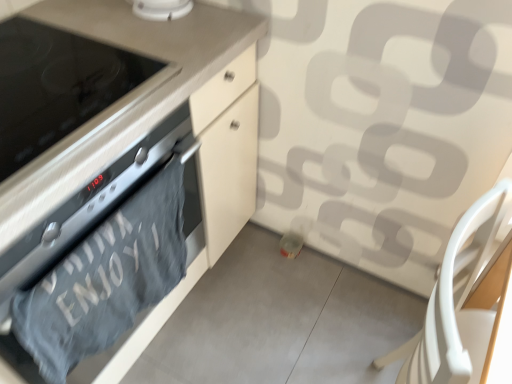
Question: Visually, is black glass stove at left positioned to the left or to the right of gray cotton towel at lower left?

Choices:
 (A) right
 (B) left

Answer: (B)

Question: Considering their positions, is black glass stove at left located in front of or behind gray cotton towel at lower left?

Choices:
 (A) front
 (B) behind

Answer: (A)

Question: Which object is the closest to the gray cotton towel at lower left?

Choices:
 (A) matte black oven at left
 (B) white plastic chair at lower right
 (C) white glossy smoke detector at upper center
 (D) black glass stove at left

Answer: (A)

Question: Estimate the real-world distances between objects in this image. Which object is farther from the black glass stove at left?

Choices:
 (A) white glossy smoke detector at upper center
 (B) matte black oven at left
 (C) gray cotton towel at lower left
 (D) white plastic chair at lower right

Answer: (D)